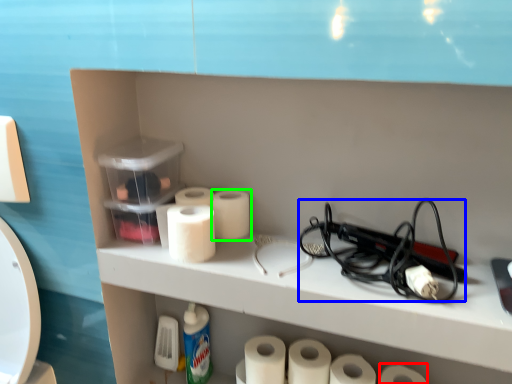
Question: Which object is the farthest from toilet paper (highlighted by a red box)? Choose among these: equipment (highlighted by a blue box) or toilet paper (highlighted by a green box).

Choices:
 (A) equipment
 (B) toilet paper

Answer: (B)